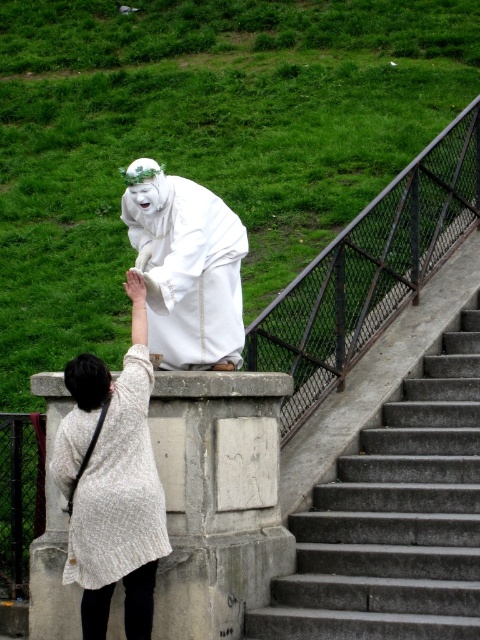
Does concrete stairs at center have a larger size compared to white textured coat at center?

No.

At what (x,y) coordinates should I click in order to perform the action: click on concrete stairs at center. Please return your answer as a coordinate pair (x, y). Looking at the image, I should click on (395, 518).

Locate an element on the screen. concrete stairs at center is located at coordinates (395, 518).

How far apart are concrete stairs at center and rusty metal rail at upper center?

concrete stairs at center is 6.22 meters away from rusty metal rail at upper center.

Consider the image. Which is above, concrete stairs at center or rusty metal rail at upper center?

rusty metal rail at upper center is higher up.

Where is `concrete stairs at center`? concrete stairs at center is located at coordinates (395, 518).

Locate an element on the screen. Image resolution: width=480 pixels, height=640 pixels. concrete stairs at center is located at coordinates (395, 518).

Who is positioned more to the right, rusty metal rail at upper center or white textured coat at center?

From the viewer's perspective, rusty metal rail at upper center appears more on the right side.

Between point (478, 109) and point (147, 518), which one is positioned behind?

The point (478, 109) is behind.

Is point (417, 236) closer to camera compared to point (128, 429)?

No, it is not.

What are the coordinates of `rusty metal rail at upper center` in the screenshot? It's located at (369, 269).